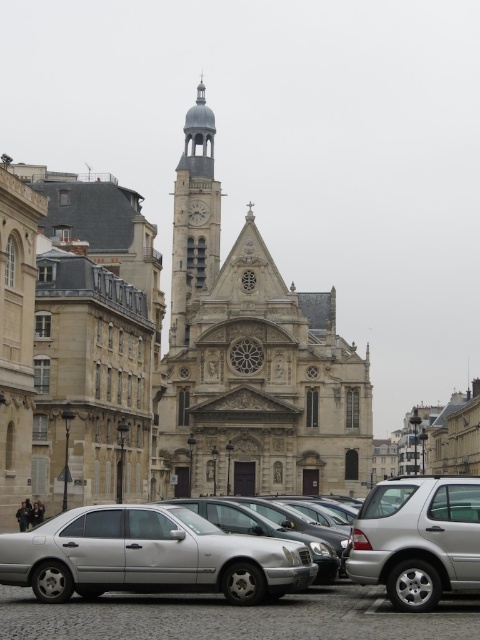
Question: Which object appears farthest from the camera in this image?

Choices:
 (A) stone church at center
 (B) smooth gray clock tower at upper center
 (C) silver metallic car at lower right

Answer: (B)

Question: Which of the following is the closest to the observer?

Choices:
 (A) (x=177, y=308)
 (B) (x=388, y=500)
 (C) (x=178, y=580)

Answer: (C)

Question: Does satin metallic car at lower left appear on the right side of smooth gray clock tower at upper center?

Choices:
 (A) no
 (B) yes

Answer: (B)

Question: Observing the image, what is the correct spatial positioning of satin metallic car at lower left in reference to smooth gray clock tower at upper center?

Choices:
 (A) right
 (B) left

Answer: (A)

Question: Which point is closer to the camera taking this photo?

Choices:
 (A) (187, 595)
 (B) (223, 445)
 (C) (183, 200)
 (D) (46, 582)

Answer: (D)

Question: Does satin metallic car at lower left appear on the left side of silver metallic car at lower right?

Choices:
 (A) no
 (B) yes

Answer: (B)